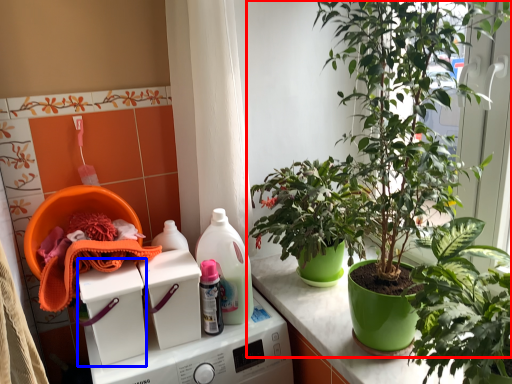
Question: Which object appears farthest to the camera in this image, houseplant (highlighted by a red box) or washing machine (highlighted by a blue box)?

Choices:
 (A) houseplant
 (B) washing machine

Answer: (B)